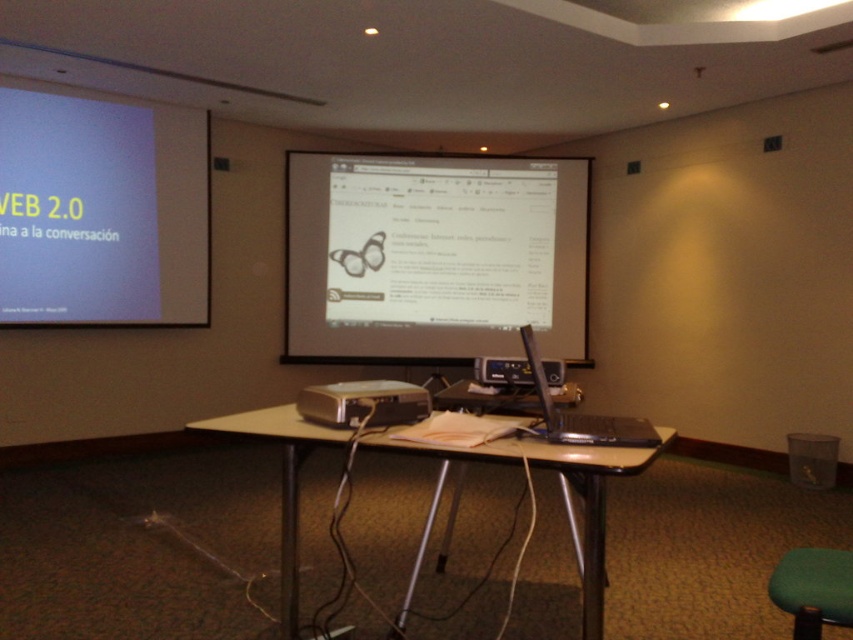
Question: Considering the real-world distances, which object is farthest from the white matte projection screen at upper left?

Choices:
 (A) black plastic laptop at center
 (B) matte white projector screen at center

Answer: (A)

Question: Which point appears closest to the camera in this image?

Choices:
 (A) (848, 552)
 (B) (521, 458)
 (C) (326, 300)
 (D) (535, 376)

Answer: (A)

Question: Does green fabric swivel chair at lower right appear on the right side of black plastic laptop at center?

Choices:
 (A) no
 (B) yes

Answer: (B)

Question: Which object is closer to the camera taking this photo?

Choices:
 (A) metallic silver table at center
 (B) green fabric swivel chair at lower right
 (C) black plastic projector at center

Answer: (B)

Question: Is white matte projection screen at upper left wider than black plastic laptop at center?

Choices:
 (A) no
 (B) yes

Answer: (B)

Question: Is green fabric swivel chair at lower right to the left of black plastic projector at center from the viewer's perspective?

Choices:
 (A) yes
 (B) no

Answer: (B)